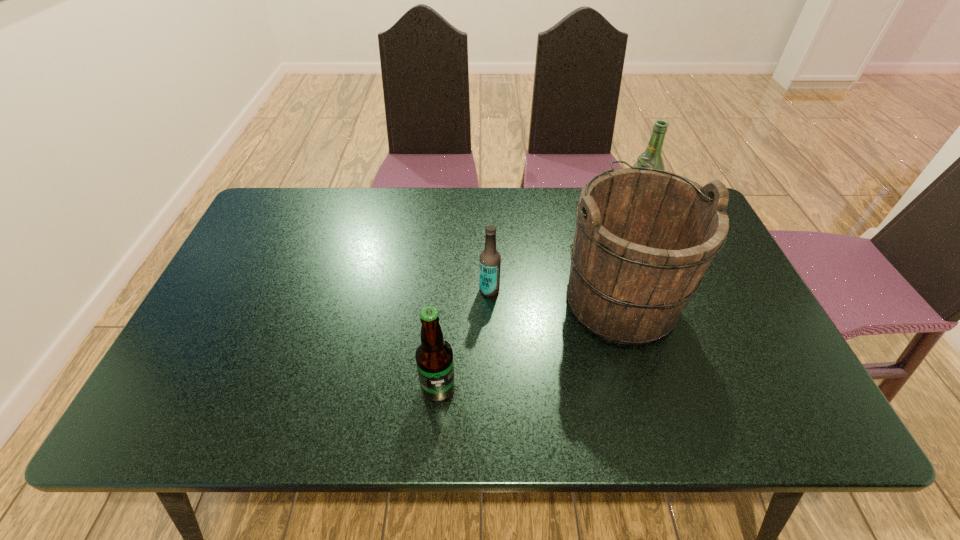
This screenshot has width=960, height=540. Find the location of `vacant space located on the surface of the farthest beer bottle`. vacant space located on the surface of the farthest beer bottle is located at coordinates (558, 208).

Where is `free space located on the label of the nearest object`? free space located on the label of the nearest object is located at coordinates [x=436, y=426].

The image size is (960, 540). I want to click on free spot located on the side of the shortest beer bottle with the label, so click(334, 290).

Locate an element on the screen. This screenshot has width=960, height=540. free space located on the side of the shortest beer bottle with the label is located at coordinates (349, 290).

Image resolution: width=960 pixels, height=540 pixels. What are the coordinates of `vacant point located 0.290m on the side of the shortest beer bottle with the label` in the screenshot? It's located at (369, 290).

Where is `object located in the far edge section of the desktop`? object located in the far edge section of the desktop is located at coordinates (651, 158).

The width and height of the screenshot is (960, 540). I want to click on object at the near edge, so click(434, 355).

At what (x,y) coordinates should I click in order to perform the action: click on object located in the right edge section of the desktop. Please return your answer as a coordinate pair (x, y). The height and width of the screenshot is (540, 960). Looking at the image, I should click on (651, 158).

Identify the location of object that is at the far right corner. (651, 158).

The height and width of the screenshot is (540, 960). In order to click on vacant region at the far edge of the desktop in this screenshot , I will do `click(552, 194)`.